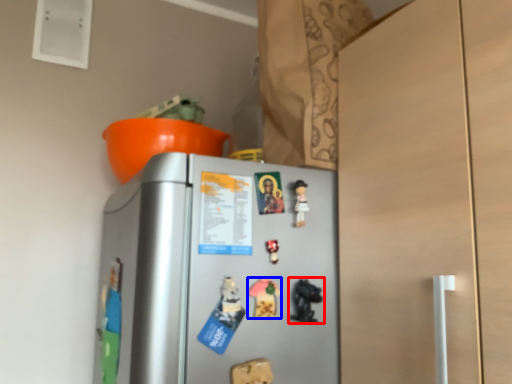
Question: Which of the following is the closest to the observer, toy (highlighted by a red box) or toy (highlighted by a blue box)?

Choices:
 (A) toy
 (B) toy

Answer: (B)